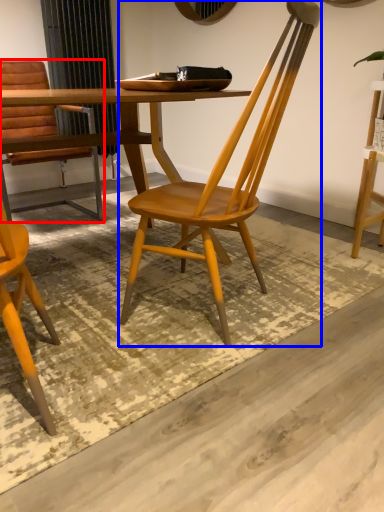
Question: Among these objects, which one is farthest to the camera, chair (highlighted by a red box) or chair (highlighted by a blue box)?

Choices:
 (A) chair
 (B) chair

Answer: (A)